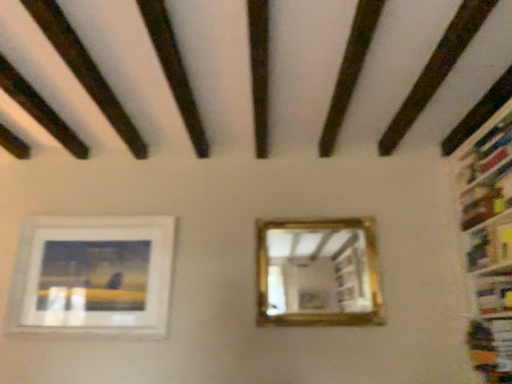
Question: Considering the relative sizes of hardcover book at right, which is the 1th book in top-to-bottom order, and hardcover book at right, which appears as the second book when viewed from the top, in the image provided, is hardcover book at right, which is the 1th book in top-to-bottom order, bigger than hardcover book at right, which appears as the second book when viewed from the top,?

Choices:
 (A) no
 (B) yes

Answer: (B)

Question: From a real-world perspective, is hardcover book at right, which appears as the second book when ordered from the bottom, over hardcover book at right, the first book ordered from the bottom?

Choices:
 (A) yes
 (B) no

Answer: (A)

Question: Does hardcover book at right, which appears as the second book when ordered from the bottom, touch hardcover book at right, which appears as the second book when viewed from the top?

Choices:
 (A) yes
 (B) no

Answer: (B)

Question: Is hardcover book at right, which appears as the second book when ordered from the bottom, shorter than hardcover book at right, which appears as the second book when viewed from the top?

Choices:
 (A) no
 (B) yes

Answer: (A)

Question: Is hardcover book at right, which is the 1th book in top-to-bottom order, wider than hardcover book at right, the first book ordered from the bottom?

Choices:
 (A) yes
 (B) no

Answer: (A)

Question: Is hardcover book at right, the first book ordered from the bottom, surrounded by hardcover book at right, which is the 1th book in top-to-bottom order?

Choices:
 (A) no
 (B) yes

Answer: (A)

Question: Can you confirm if gold-framed mirror at center is bigger than hardcover book at right, which is the 1th book in top-to-bottom order?

Choices:
 (A) yes
 (B) no

Answer: (A)

Question: Is gold-framed mirror at center facing towards hardcover book at right, which is the 1th book in top-to-bottom order?

Choices:
 (A) yes
 (B) no

Answer: (B)

Question: Does gold-framed mirror at center appear on the right side of hardcover book at right, which is the 1th book in top-to-bottom order?

Choices:
 (A) no
 (B) yes

Answer: (A)

Question: From a real-world perspective, is gold-framed mirror at center physically below hardcover book at right, which appears as the second book when ordered from the bottom?

Choices:
 (A) yes
 (B) no

Answer: (A)

Question: Is gold-framed mirror at center positioned with its back to hardcover book at right, which appears as the second book when ordered from the bottom?

Choices:
 (A) yes
 (B) no

Answer: (B)

Question: Considering the relative sizes of gold-framed mirror at center and hardcover book at right, which appears as the second book when ordered from the bottom, in the image provided, is gold-framed mirror at center wider than hardcover book at right, which appears as the second book when ordered from the bottom,?

Choices:
 (A) yes
 (B) no

Answer: (B)

Question: Is hardcover book at right, the first book ordered from the bottom, aimed at gold-framed mirror at center?

Choices:
 (A) no
 (B) yes

Answer: (B)